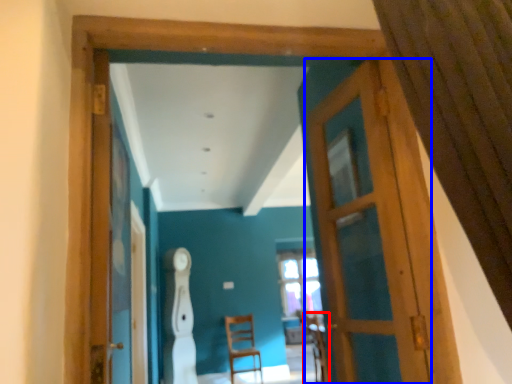
Question: Which object appears farthest to the camera in this image, armchair (highlighted by a red box) or door (highlighted by a blue box)?

Choices:
 (A) armchair
 (B) door

Answer: (A)